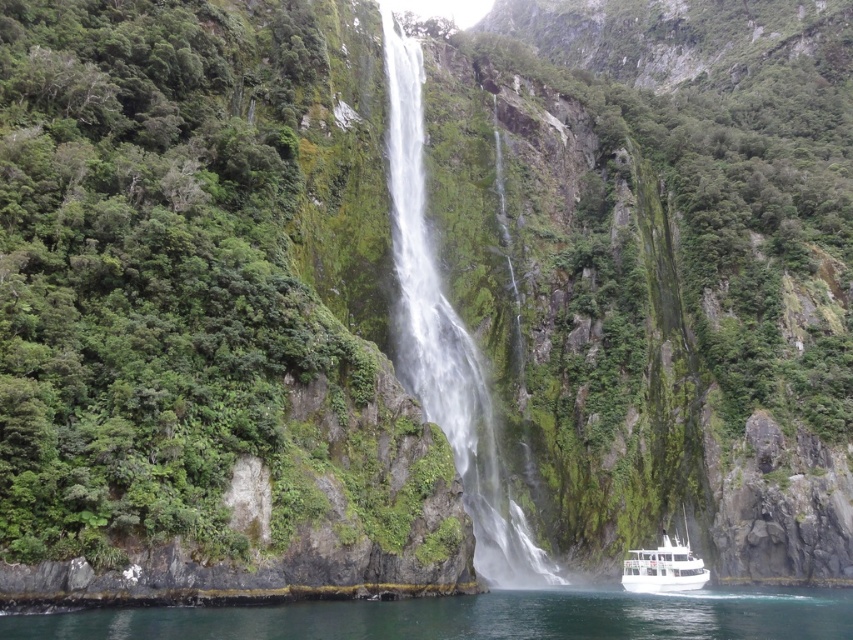
I want to click on clear water at lower left, so click(477, 616).

Who is positioned more to the left, clear water at lower left or white glossy boat at lower center?

Positioned to the left is clear water at lower left.

Where is `clear water at lower left`? This screenshot has height=640, width=853. clear water at lower left is located at coordinates (477, 616).

The height and width of the screenshot is (640, 853). I want to click on clear water at lower left, so click(x=477, y=616).

Is point (485, 548) farther from viewer compared to point (654, 561)?

Yes.

Which is above, white frothy water at center or white glossy boat at lower center?

white frothy water at center

Describe the element at coordinates (445, 339) in the screenshot. I see `white frothy water at center` at that location.

The height and width of the screenshot is (640, 853). What are the coordinates of `white frothy water at center` in the screenshot? It's located at (445, 339).

Who is taller, clear water at lower left or white frothy water at center?

Standing taller between the two is white frothy water at center.

Is clear water at lower left to the left of white frothy water at center from the viewer's perspective?

Incorrect, clear water at lower left is not on the left side of white frothy water at center.

You are a GUI agent. You are given a task and a screenshot of the screen. Output one action in this format:
    pyautogui.click(x=<x>, y=<y>)
    Task: Click on the clear water at lower left
    Image resolution: width=853 pixels, height=640 pixels.
    Given the screenshot: What is the action you would take?
    pyautogui.click(x=477, y=616)